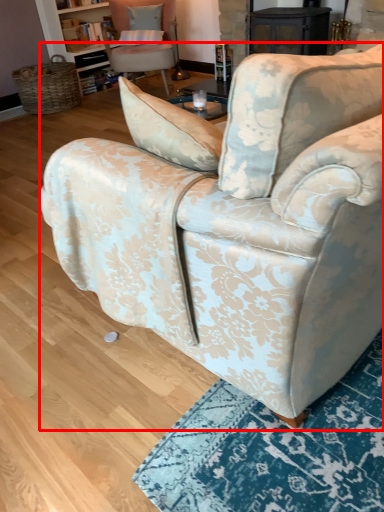
Question: From the image's perspective, considering the relative positions of chair (annotated by the red box) and chair in the image provided, where is chair (annotated by the red box) located with respect to the staircase?

Choices:
 (A) below
 (B) above

Answer: (A)